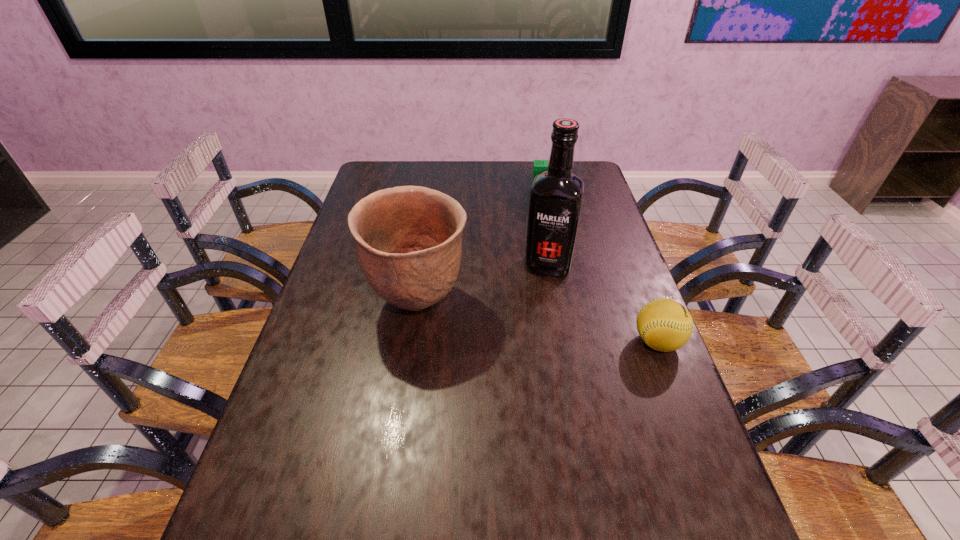
You are a GUI agent. You are given a task and a screenshot of the screen. Output one action in this format:
    pyautogui.click(x=<x>, y=<y>)
    Task: Click on the vacant space located on the front-facing side of the liquor
    The image size is (960, 540).
    Given the screenshot: What is the action you would take?
    pyautogui.click(x=524, y=394)

Where is `free space located on the front-facing side of the liquor`? The image size is (960, 540). free space located on the front-facing side of the liquor is located at coordinates (527, 376).

Where is `object at the far edge`? object at the far edge is located at coordinates (539, 166).

Where is `object positioned at the left edge`? The image size is (960, 540). object positioned at the left edge is located at coordinates (408, 240).

I want to click on softball located in the right edge section of the desktop, so click(x=665, y=325).

I want to click on alarm clock located at the right edge, so click(539, 166).

Identify the location of object located in the far right corner section of the desktop. (539, 166).

What are the coordinates of `free space at the far edge of the desktop` in the screenshot? It's located at (442, 172).

Identify the location of vacant point at the left edge. (370, 322).

This screenshot has height=540, width=960. In the image, there is a desktop. What are the coordinates of `free space at the right edge` in the screenshot? It's located at pos(589,292).